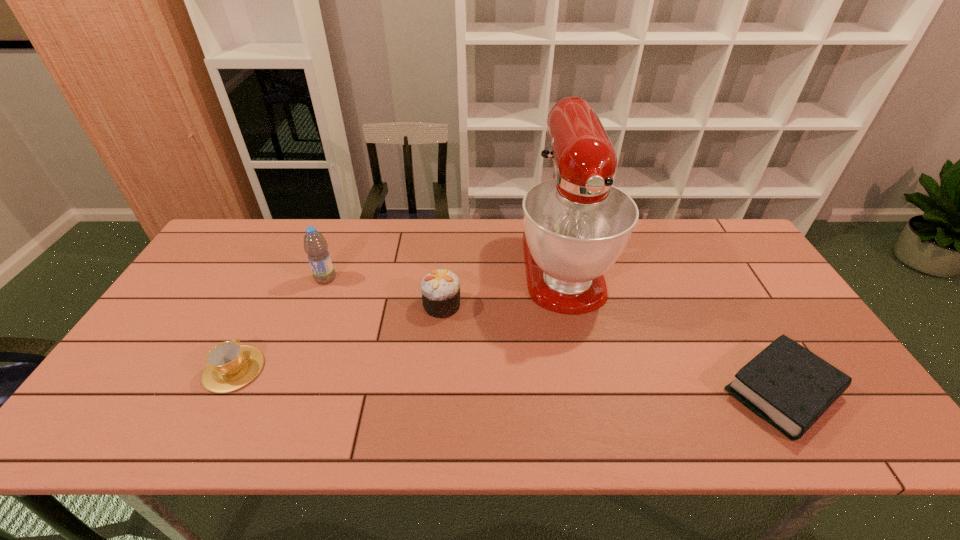
Where is `empty space between the third object from right to left and the leftmost object`? This screenshot has width=960, height=540. empty space between the third object from right to left and the leftmost object is located at coordinates (338, 337).

Where is `free area in between the Bible and the third shortest object`? This screenshot has height=540, width=960. free area in between the Bible and the third shortest object is located at coordinates (612, 348).

I want to click on vacant space in between the cupcake and the second object from left to right, so click(x=384, y=292).

Locate an element on the screen. object that is the fourth nearest to the third tallest object is located at coordinates (787, 385).

You are a GUI agent. You are given a task and a screenshot of the screen. Output one action in this format:
    pyautogui.click(x=<x>, y=<y>)
    Task: Click on the object that is the third nearest to the cup
    This screenshot has height=540, width=960.
    Given the screenshot: What is the action you would take?
    pyautogui.click(x=576, y=225)

Identify the location of free space that satisfies the following two spatial constraints: 1. on the front side of the rightmost object; 2. on the left side of the third object from right to left. The height and width of the screenshot is (540, 960). (434, 392).

The width and height of the screenshot is (960, 540). I want to click on vacant space that satisfies the following two spatial constraints: 1. on the front side of the third object from right to left; 2. on the right side of the water bottle, so click(315, 305).

You are a GUI agent. You are given a task and a screenshot of the screen. Output one action in this format:
    pyautogui.click(x=<x>, y=<y>)
    Task: Click on the vacant position in the image that satisfies the following two spatial constraints: 1. with the handle on the side of the third object from right to left; 2. on the right side of the cup
    The image size is (960, 540).
    Given the screenshot: What is the action you would take?
    click(x=266, y=305)

Find the location of `blank area in the image that satisfies the following two spatial constraints: 1. with the handle on the side of the leftmost object; 2. on the right side of the third object from right to left`. blank area in the image that satisfies the following two spatial constraints: 1. with the handle on the side of the leftmost object; 2. on the right side of the third object from right to left is located at coordinates (266, 305).

The width and height of the screenshot is (960, 540). I want to click on blank space that satisfies the following two spatial constraints: 1. on the front side of the rightmost object; 2. on the left side of the second object from left to right, so click(x=281, y=392).